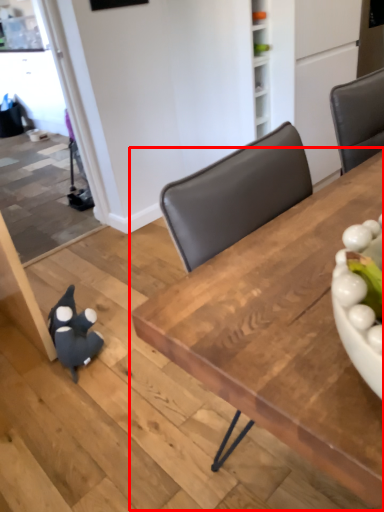
Question: From the image's perspective, where is table (annotated by the red box) located in relation to toy in the image?

Choices:
 (A) above
 (B) below

Answer: (A)